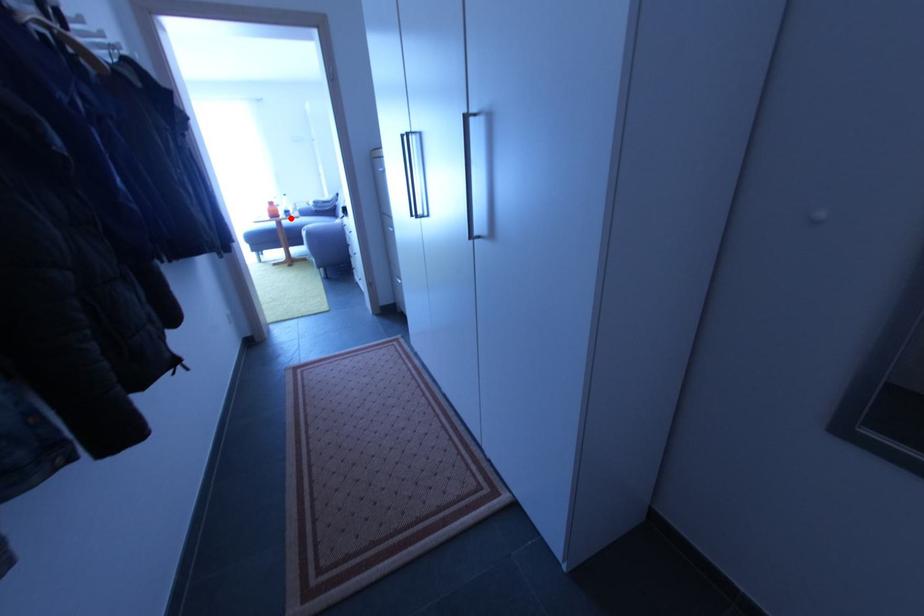
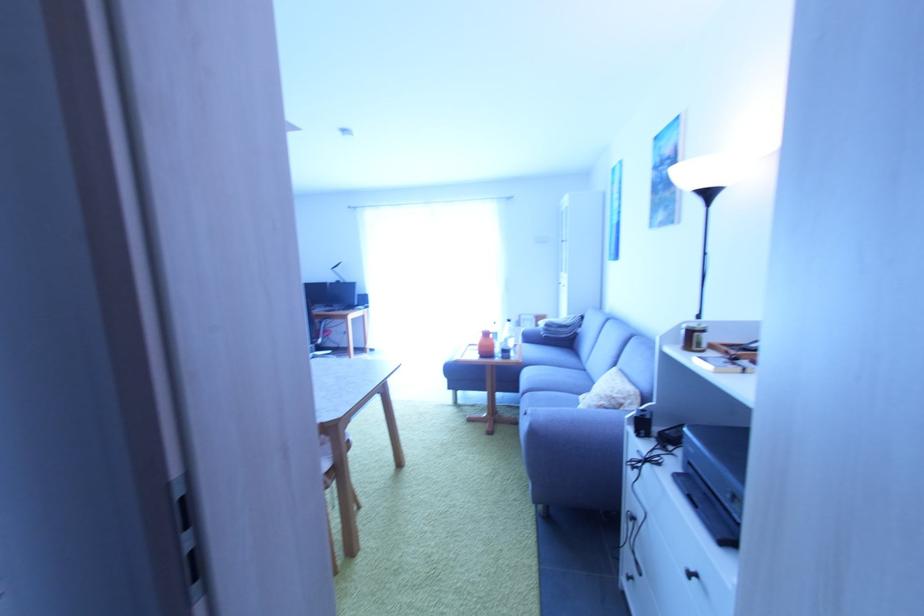
Question: I am providing you with two images of the same scene from different viewpoints. Image1 has a red point marked. In image2, the corresponding 3D location appears at what relative position? Reply with the corresponding letter.

Choices:
 (A) Closer
 (B) Farther

Answer: (B)